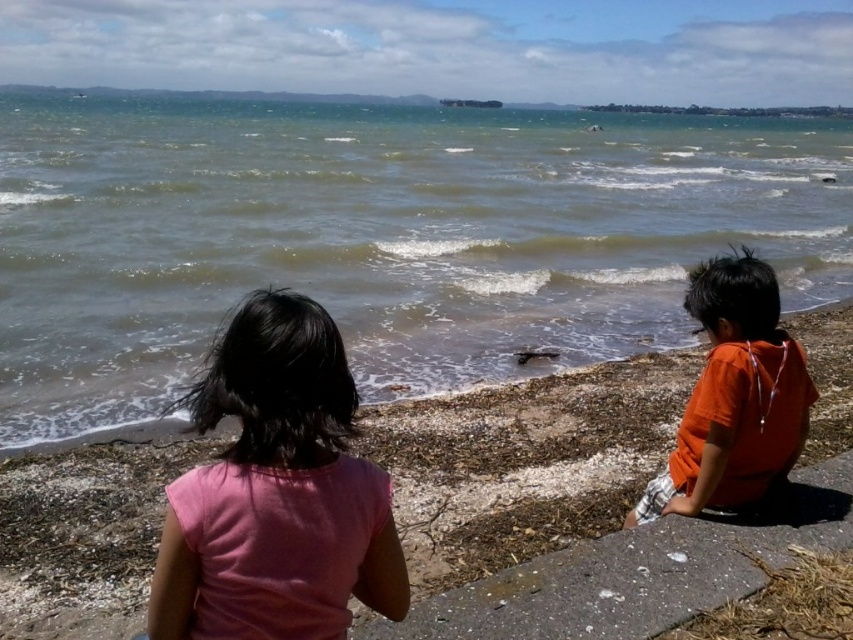
Between blue water at center and white concrete stone at lower right, which one has more height?

With more height is blue water at center.

Does blue water at center have a larger size compared to white concrete stone at lower right?

Yes, blue water at center is bigger than white concrete stone at lower right.

This screenshot has width=853, height=640. What are the coordinates of `blue water at center` in the screenshot? It's located at pos(378,236).

I want to click on blue water at center, so click(x=378, y=236).

Can you confirm if blue water at center is positioned to the right of pink fabric shirt at center?

No, blue water at center is not to the right of pink fabric shirt at center.

Who is higher up, blue water at center or pink fabric shirt at center?

blue water at center is above.

Is point (531, 200) farther from viewer compared to point (309, 330)?

Yes, point (531, 200) is behind point (309, 330).

At what (x,y) coordinates should I click in order to perform the action: click on blue water at center. Please return your answer as a coordinate pair (x, y). Looking at the image, I should click on (378, 236).

Which of these two, pink fabric shirt at center or white concrete stone at lower right, stands shorter?

With less height is white concrete stone at lower right.

You are a GUI agent. You are given a task and a screenshot of the screen. Output one action in this format:
    pyautogui.click(x=<x>, y=<y>)
    Task: Click on the pink fabric shirt at center
    The height and width of the screenshot is (640, 853).
    Given the screenshot: What is the action you would take?
    pyautogui.click(x=276, y=492)

Is point (254, 572) farther from viewer compared to point (631, 536)?

No, (254, 572) is closer to viewer.

Where is `pink fabric shirt at center`? This screenshot has width=853, height=640. pink fabric shirt at center is located at coordinates (276, 492).